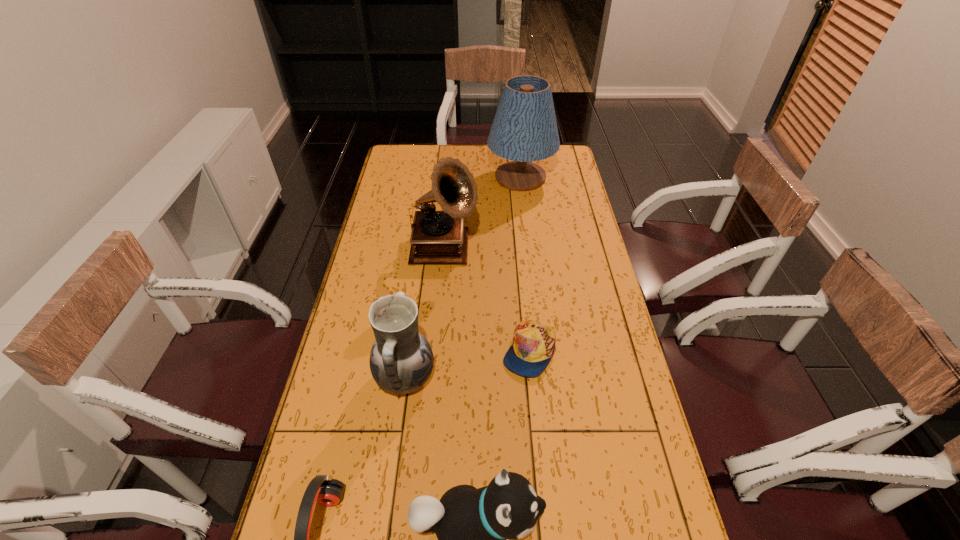
Where is `lampshade`? lampshade is located at coordinates (524, 130).

Where is `the second farthest object`? the second farthest object is located at coordinates (438, 237).

Locate an element on the screen. the third tallest object is located at coordinates (401, 360).

Identify the location of cap. (533, 346).

This screenshot has height=540, width=960. What are the coordinates of `vacant area situated 0.170m on the front of the farthest object` in the screenshot? It's located at (526, 222).

Identify the location of free space located on the horn of the fifth nearest object. The height and width of the screenshot is (540, 960). (563, 251).

What are the coordinates of `free space located 0.210m on the front-facing side of the pitcher` in the screenshot? It's located at (511, 378).

Where is `vacant space located on the bill of the shortest object`? vacant space located on the bill of the shortest object is located at coordinates (544, 512).

The height and width of the screenshot is (540, 960). Find the location of `object present at the far edge`. object present at the far edge is located at coordinates (524, 130).

This screenshot has width=960, height=540. Find the location of `object that is positioned at the left edge`. object that is positioned at the left edge is located at coordinates (401, 360).